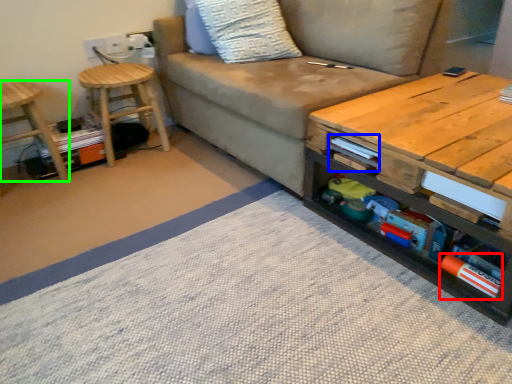
Question: Considering the real-world distances, which object is closest to book (highlighted by a red box)? book (highlighted by a blue box) or stool (highlighted by a green box).

Choices:
 (A) book
 (B) stool

Answer: (A)